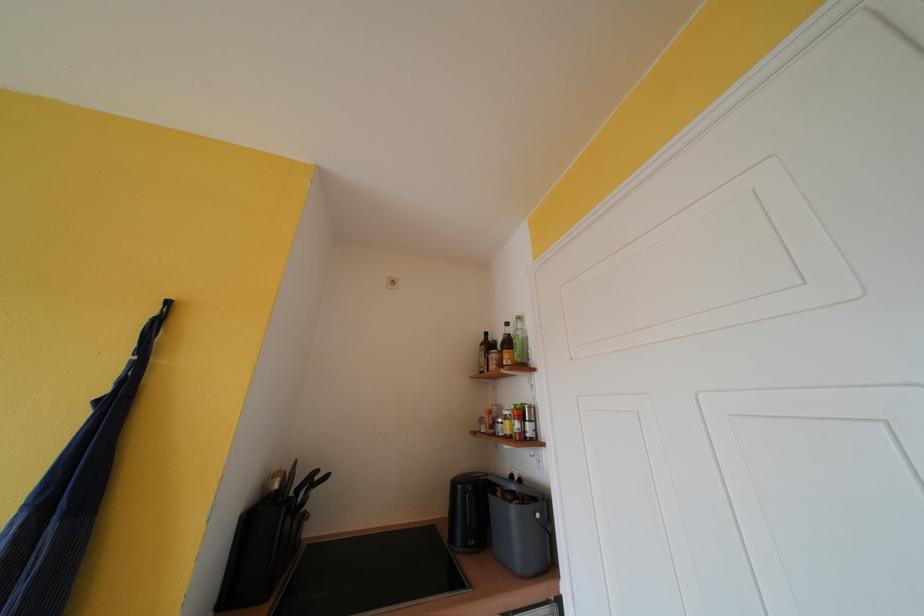
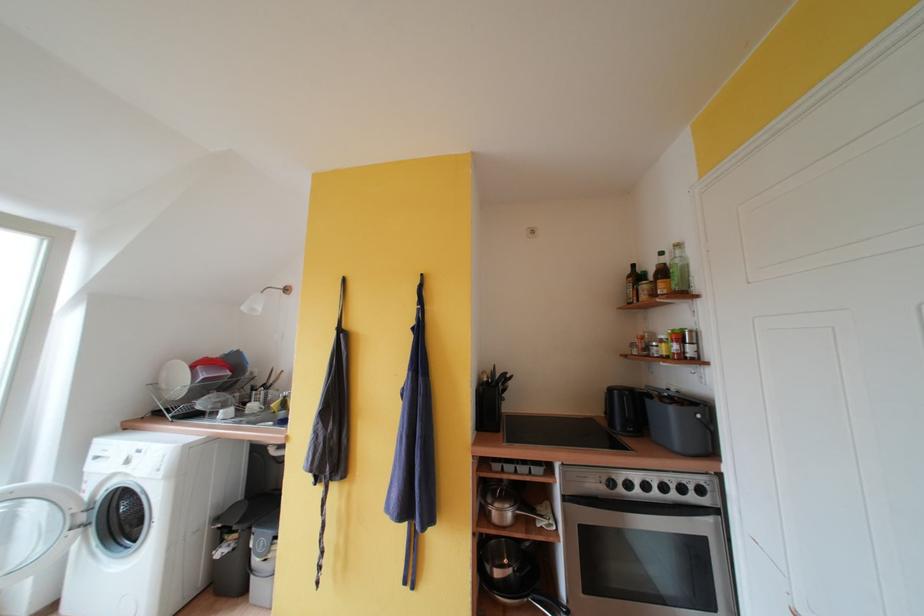
Question: I am providing you with two images of the same scene from different viewpoints. Which of the following objects are not visible in image2?

Choices:
 (A) brown glass bottle
 (B) red plastic container
 (C) black wall hook
 (D) none of these

Answer: (D)